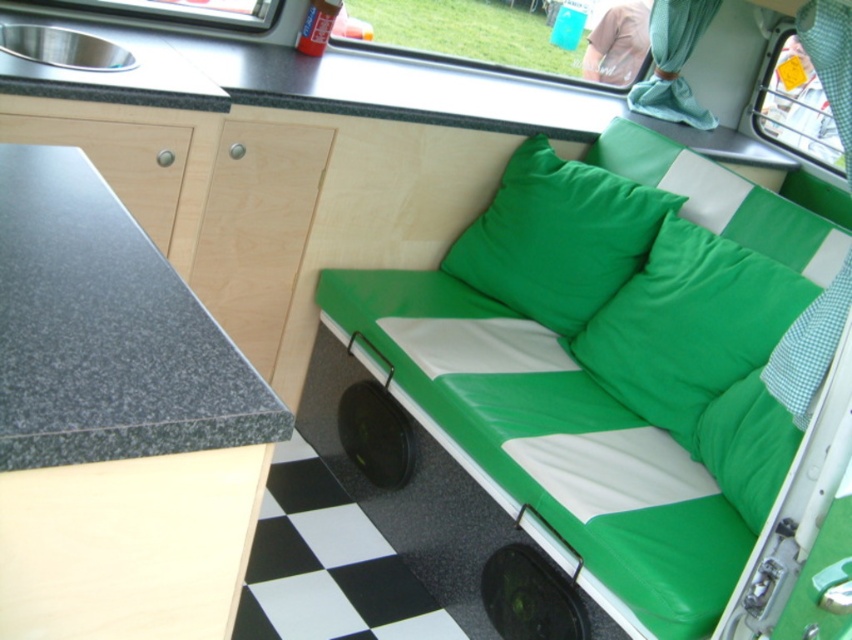
You are organizing the cushions in the camper van. You need to place a new decorative pillow between the green fabric pillow at center and the green fabric pillow at upper right. Where should you place it to maintain the vertical arrangement?

The new decorative pillow should be placed between the green fabric pillow at center and the green fabric pillow at upper right, maintaining the vertical arrangement by placing it either above the green fabric pillow at center or below the green fabric pillow at upper right since they are arranged vertically with the green fabric pillow at center below the upper one.

You are standing inside the camper van and want to place a small plant between the two points, point (99, 214) and point (488, 252). Which point should the plant be closer to in order to appear larger in the photo taken from your current position?

The plant should be placed closer to point (99, 214) because it is closer to the camera, making objects placed there appear larger in the photo.

You are organizing a small dinner party in this camper van and need to place a 10cm tall candle on a surface that can accommodate its height. Which object between the granite countertop at left and the green fabric pillow at center should you choose?

The granite countertop at left has a lesser height compared to the green fabric pillow at center. Since the candle is only 10cm tall, the granite countertop at left would be sufficient as it can still support the candle without any issues related to height.